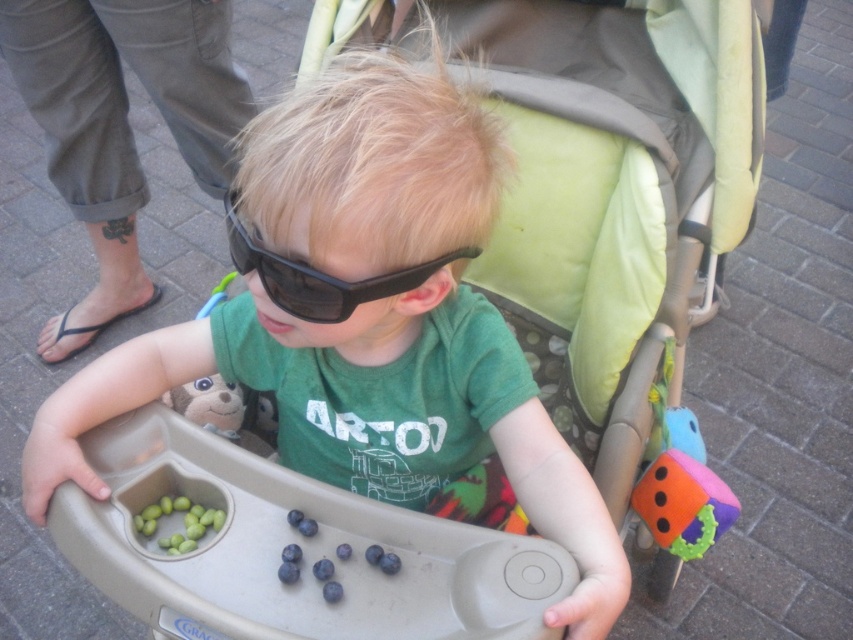
Which of these two, matte black sunglasses at center or black matte sunglasses at center, stands taller?

Standing taller between the two is matte black sunglasses at center.

Which is in front, point (204, 371) or point (306, 305)?

Point (306, 305) is in front.

What do you see at coordinates (364, 321) in the screenshot?
I see `matte black sunglasses at center` at bounding box center [364, 321].

In order to click on matte black sunglasses at center in this screenshot , I will do `click(364, 321)`.

Is point (628, 196) less distant than point (184, 547)?

No, it is behind (184, 547).

Which is in front, point (666, 13) or point (175, 513)?

Point (175, 513) is in front.

Does point (369, 24) lie behind point (178, 500)?

Yes, point (369, 24) is farther from viewer.

This screenshot has height=640, width=853. I want to click on green fabric baby carriage at center, so click(x=601, y=188).

Can you confirm if matte black sunglasses at center is positioned to the left of rubberized orange die at center?

Indeed, matte black sunglasses at center is positioned on the left side of rubberized orange die at center.

Does matte black sunglasses at center have a larger size compared to rubberized orange die at center?

Indeed, matte black sunglasses at center has a larger size compared to rubberized orange die at center.

Is point (316, 205) behind point (680, 512)?

No, it is not.

At what (x,y) coordinates should I click in order to perform the action: click on matte black sunglasses at center. Please return your answer as a coordinate pair (x, y). This screenshot has height=640, width=853. Looking at the image, I should click on (364, 321).